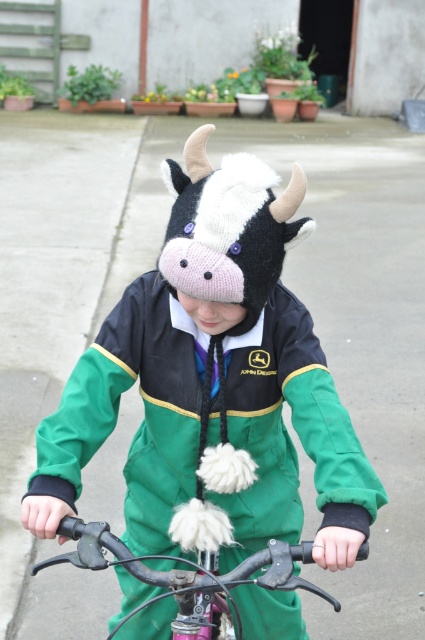
A person is riding a bicycle and wearing a cow head hat. The person and the bicycle are at coordinates point (198, 256). If the person wants to get off the bicycle, will they have enough space to stand up straight without hitting their hat on the ground?

The distance between the person and the bicycle is 2.24 meters, so yes, they have enough space to stand up straight without hitting their hat on the ground.

You are a photographer trying to capture a clear photo of the knitted woolen hat at center and the metallic silver bicycle handlebars at center. Which object should you focus on first if you want to ensure both are in focus, considering their sizes?

The knitted woolen hat at center is larger in size than the metallic silver bicycle handlebars at center, so you should focus on the knitted woolen hat at center first to ensure both are in focus.

The person is wearing a knitted woolen hat at center and holding onto metallic silver bicycle handlebars at center. Which object is closer to the viewer?

The knitted woolen hat at center is closer to the viewer because the metallic silver bicycle handlebars at center is behind it.